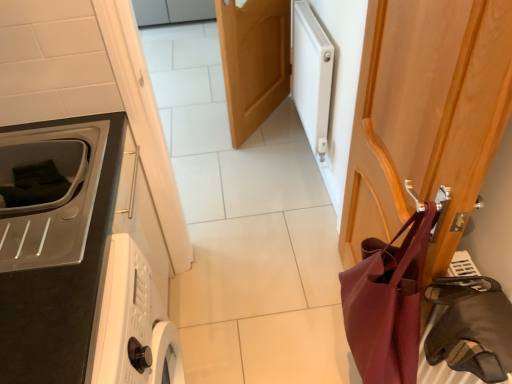
Identify the location of blank space to the left of wooden coat hanger at right, placed as the 1th door when sorted from front to back. (271, 315).